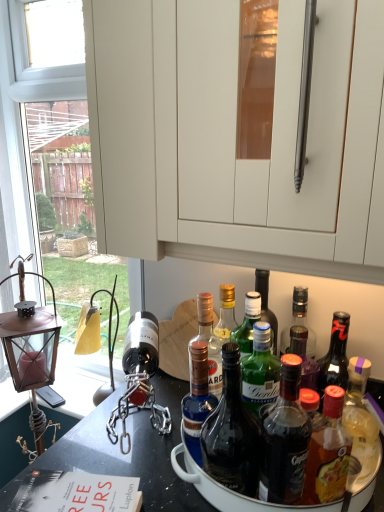
Question: Can you confirm if blue glass bottle at center, acting as the fourth bottle starting from the right, is shorter than bronze lantern at left?

Choices:
 (A) no
 (B) yes

Answer: (B)

Question: Is blue glass bottle at center, acting as the fourth bottle starting from the right, not close to bronze lantern at left?

Choices:
 (A) yes
 (B) no

Answer: (B)

Question: From the image's perspective, does blue glass bottle at center, acting as the fourth bottle starting from the right, appear higher than bronze lantern at left?

Choices:
 (A) yes
 (B) no

Answer: (A)

Question: Is blue glass bottle at center, the 2th bottle when ordered from left to right, closer to the viewer compared to bronze lantern at left?

Choices:
 (A) no
 (B) yes

Answer: (B)

Question: From a real-world perspective, is blue glass bottle at center, the 2th bottle when ordered from left to right, below bronze lantern at left?

Choices:
 (A) yes
 (B) no

Answer: (B)

Question: Based on their positions, is translucent plastic bottle at lower right, which is the fifth bottle from left to right, located to the left or right of blue glass bottle at center, which is the 1th bottle from left to right?

Choices:
 (A) right
 (B) left

Answer: (A)

Question: Is point (339, 439) positioned closer to the camera than point (196, 396)?

Choices:
 (A) closer
 (B) farther

Answer: (A)

Question: Looking at their shapes, would you say translucent plastic bottle at lower right, which is counted as the first bottle, starting from the right, is wider or thinner than blue glass bottle at center, which appears as the 5th bottle when viewed from the right?

Choices:
 (A) wide
 (B) thin

Answer: (A)

Question: From a real-world perspective, is translucent plastic bottle at lower right, which is the fifth bottle from left to right, physically located above or below blue glass bottle at center, which is the 1th bottle from left to right?

Choices:
 (A) below
 (B) above

Answer: (A)

Question: Considering the positions of point (230, 410) and point (34, 335), is point (230, 410) closer or farther from the camera than point (34, 335)?

Choices:
 (A) closer
 (B) farther

Answer: (A)

Question: From a real-world perspective, is translucent glass bottle at center, the third bottle from the right, physically located above or below bronze lantern at left?

Choices:
 (A) above
 (B) below

Answer: (A)

Question: Is translucent glass bottle at center, the third bottle in the left-to-right sequence, taller or shorter than bronze lantern at left?

Choices:
 (A) short
 (B) tall

Answer: (A)

Question: Considering the positions of translucent glass bottle at center, the third bottle from the right, and bronze lantern at left in the image, is translucent glass bottle at center, the third bottle from the right, wider or thinner than bronze lantern at left?

Choices:
 (A) thin
 (B) wide

Answer: (A)

Question: From a real-world perspective, is translucent glass bottle at center, the third bottle in the left-to-right sequence, physically located above or below blue glass bottle at center, which appears as the 5th bottle when viewed from the right?

Choices:
 (A) above
 (B) below

Answer: (A)

Question: Is translucent glass bottle at center, the third bottle in the left-to-right sequence, bigger or smaller than blue glass bottle at center, which is the 1th bottle from left to right?

Choices:
 (A) small
 (B) big

Answer: (B)